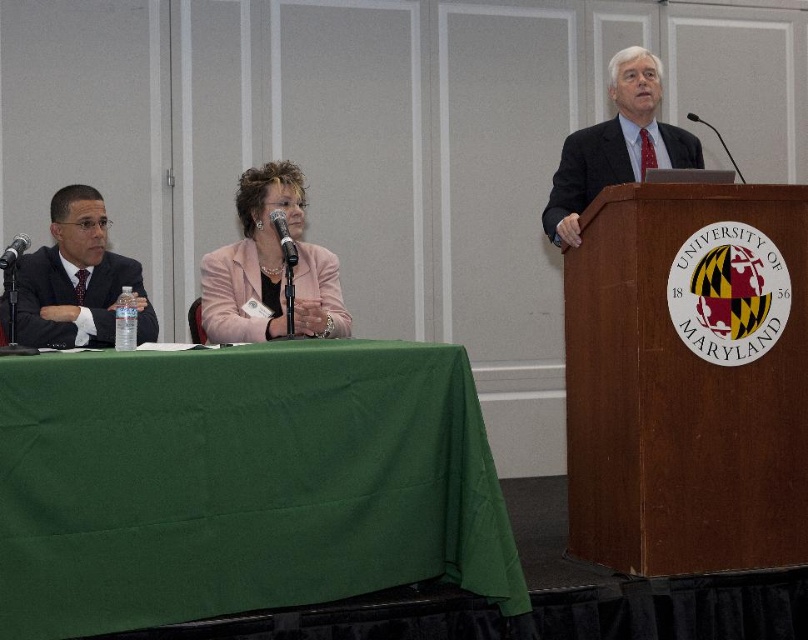
You are a photographer positioned behind the stage at the University of Maryland event. You want to capture a photo of both the pink fabric jacket at center and the matte black suit at left in the same frame. Given that your camera has a minimum focus range of 18 inches, will you be able to focus on both subjects simultaneously?

The distance between the pink fabric jacket at center and the matte black suit at left is 19.67 inches, which exceeds the camera minimum focus range of 18 inches. Therefore, you can focus on both subjects simultaneously.